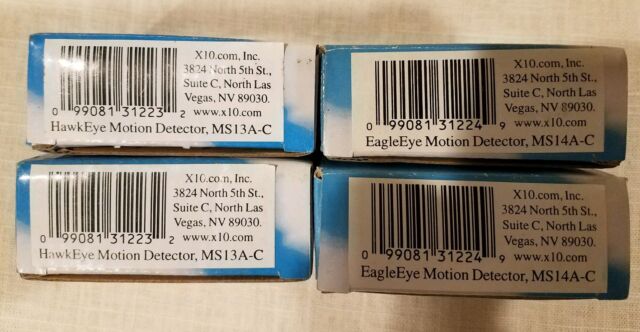
Where is `table`? This screenshot has width=640, height=332. table is located at coordinates (271, 307).